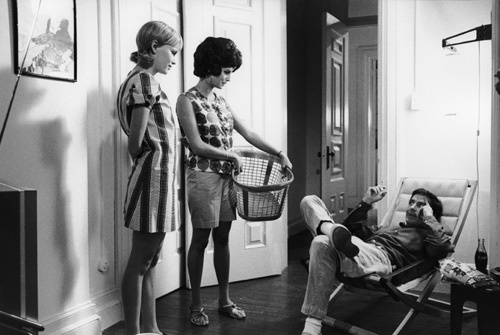
Where is `floor`? This screenshot has height=335, width=500. floor is located at coordinates (265, 316).